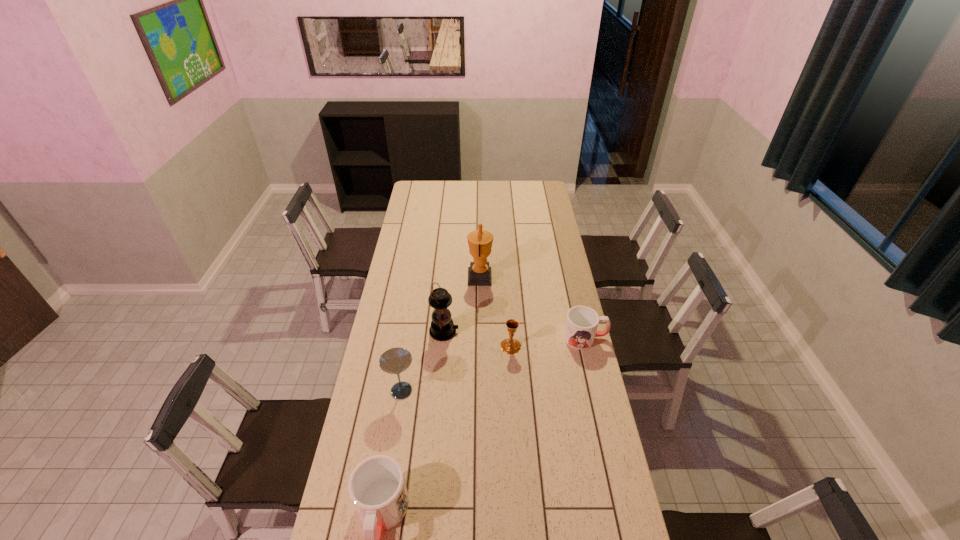
Find the location of `the right mug`. the right mug is located at coordinates (582, 322).

The height and width of the screenshot is (540, 960). What are the coordinates of `the rightmost object` in the screenshot? It's located at 582,322.

Locate an element on the screen. The width and height of the screenshot is (960, 540). the third object from right to left is located at coordinates (480, 241).

I want to click on the farthest object, so click(480, 241).

The height and width of the screenshot is (540, 960). Find the location of `martini`. martini is located at coordinates (395, 360).

Where is `the fifth shortest object`? Image resolution: width=960 pixels, height=540 pixels. the fifth shortest object is located at coordinates (442, 328).

I want to click on the third object from left to right, so click(442, 328).

The image size is (960, 540). What are the coordinates of `the fifth object from left to right` in the screenshot? It's located at coord(510,346).

I want to click on free space located at the front of the third object from right to left with handles, so click(428, 277).

Locate an element on the screen. Image resolution: width=960 pixels, height=540 pixels. blank space located 0.070m at the front of the third object from right to left with handles is located at coordinates (454, 277).